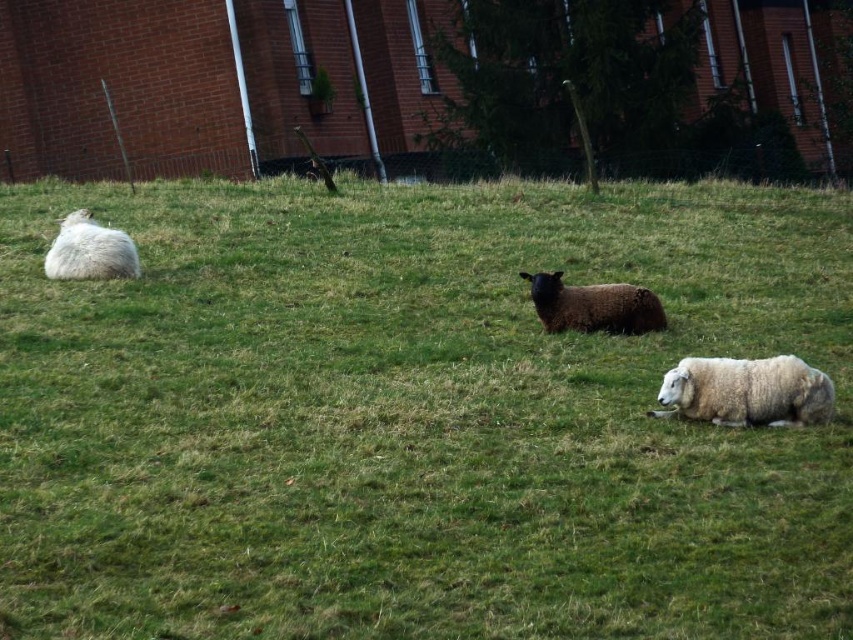
In the scene shown: Which is more to the right, white woolly sheep at lower right or dark brown woolly sheep at center?

white woolly sheep at lower right

Does white woolly sheep at lower right appear on the left side of dark brown woolly sheep at center?

Incorrect, white woolly sheep at lower right is not on the left side of dark brown woolly sheep at center.

Who is more distant from viewer, (778, 385) or (558, 272)?

Positioned behind is point (558, 272).

Where is `white woolly sheep at lower right`? This screenshot has width=853, height=640. white woolly sheep at lower right is located at coordinates (746, 392).

Is white woolly sheep at upper left positioned at the back of white fluffy sheep at left?

No, it is in front of white fluffy sheep at left.

Between white woolly sheep at upper left and white fluffy sheep at left, which one is positioned higher?

white fluffy sheep at left is above.

Describe the element at coordinates (415, 417) in the screenshot. I see `white woolly sheep at upper left` at that location.

At what (x,y) coordinates should I click in order to perform the action: click on white woolly sheep at upper left. Please return your answer as a coordinate pair (x, y). Image resolution: width=853 pixels, height=640 pixels. Looking at the image, I should click on (415, 417).

Is white woolly sheep at upper left further to camera compared to dark brown woolly sheep at center?

No, white woolly sheep at upper left is in front of dark brown woolly sheep at center.

Can you confirm if white woolly sheep at upper left is smaller than dark brown woolly sheep at center?

Actually, white woolly sheep at upper left might be larger than dark brown woolly sheep at center.

Between point (814, 481) and point (657, 321), which one is positioned in front?

Point (814, 481) is in front.

You are a GUI agent. You are given a task and a screenshot of the screen. Output one action in this format:
    pyautogui.click(x=<x>, y=<y>)
    Task: Click on the white woolly sheep at upper left
    This screenshot has width=853, height=640.
    Given the screenshot: What is the action you would take?
    pyautogui.click(x=415, y=417)